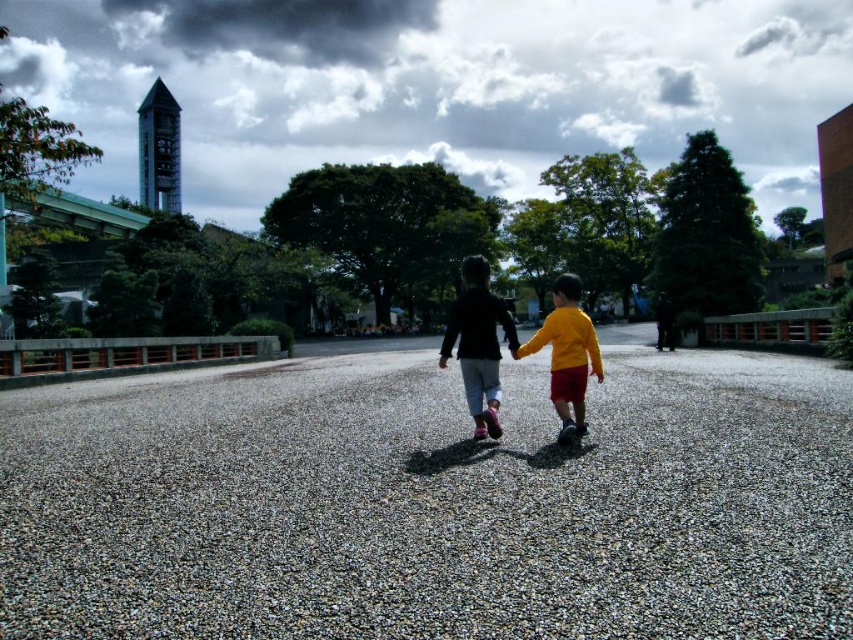
In order to click on gray gravel at center in this screenshot , I will do `click(430, 502)`.

Is gray gravel at center bigger than matte black jacket at center?

No, gray gravel at center is not bigger than matte black jacket at center.

Is point (488, 529) behind point (466, 336)?

No, (488, 529) is in front of (466, 336).

Image resolution: width=853 pixels, height=640 pixels. In order to click on gray gravel at center in this screenshot , I will do `click(430, 502)`.

Is gray gravel at center closer to the viewer compared to matte black pants at center?

Yes, gray gravel at center is in front of matte black pants at center.

Which is in front, point (51, 436) or point (485, 292)?

Point (485, 292) is more forward.

The width and height of the screenshot is (853, 640). Identify the location of gray gravel at center. (430, 502).

Does matte black jacket at center appear under matte black pants at center?

Indeed, matte black jacket at center is positioned under matte black pants at center.

Which is below, matte black jacket at center or matte black pants at center?

matte black jacket at center

The width and height of the screenshot is (853, 640). What are the coordinates of `matte black jacket at center` in the screenshot? It's located at (519, 348).